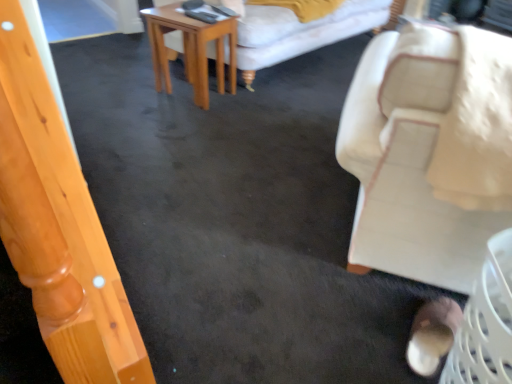
Question: Can you confirm if brown suede shoe at lower right is smaller than light brown wooden table at center?

Choices:
 (A) no
 (B) yes

Answer: (B)

Question: From the image's perspective, would you say brown suede shoe at lower right is positioned over light brown wooden table at center?

Choices:
 (A) yes
 (B) no

Answer: (B)

Question: Is brown suede shoe at lower right thinner than light brown wooden table at center?

Choices:
 (A) yes
 (B) no

Answer: (A)

Question: Does brown suede shoe at lower right have a larger size compared to light brown wooden table at center?

Choices:
 (A) yes
 (B) no

Answer: (B)

Question: Is brown suede shoe at lower right not near light brown wooden table at center?

Choices:
 (A) no
 (B) yes

Answer: (B)

Question: Is brown suede shoe at lower right positioned before light brown wooden table at center?

Choices:
 (A) no
 (B) yes

Answer: (B)

Question: Does light brown wooden table at center turn towards beige fabric chair at right?

Choices:
 (A) yes
 (B) no

Answer: (B)

Question: Does light brown wooden table at center lie behind beige fabric chair at right?

Choices:
 (A) yes
 (B) no

Answer: (A)

Question: Considering the relative sizes of light brown wooden table at center and beige fabric chair at right in the image provided, is light brown wooden table at center shorter than beige fabric chair at right?

Choices:
 (A) yes
 (B) no

Answer: (A)

Question: Does light brown wooden table at center have a smaller size compared to beige fabric chair at right?

Choices:
 (A) no
 (B) yes

Answer: (B)

Question: Does light brown wooden table at center touch beige fabric chair at right?

Choices:
 (A) no
 (B) yes

Answer: (A)

Question: From the image's perspective, is light brown wooden table at center beneath beige fabric chair at right?

Choices:
 (A) yes
 (B) no

Answer: (B)

Question: Does beige fabric chair at right have a greater height compared to brown suede shoe at lower right?

Choices:
 (A) yes
 (B) no

Answer: (A)